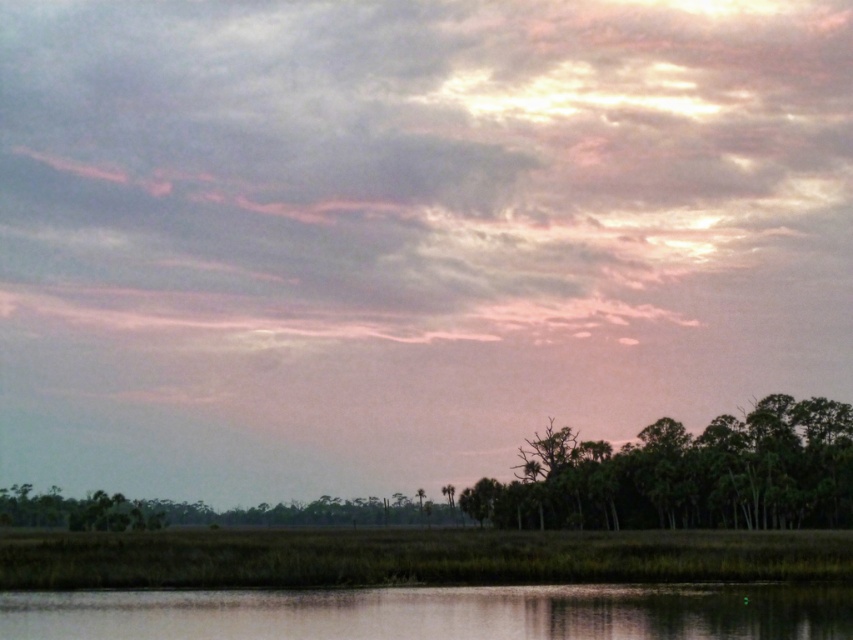
You are standing at the edge of a lake and see the smooth water at bottom and the green leafy trees at lower right. Which object takes up more space in the image?

The green leafy trees at lower right take up more space in the image than the smooth water at bottom.

You are standing in the landscape scene and want to take a photo. There are two points in the image, point 1 at coordinates point (473,602) and point 2 at coordinates point (669,440). Which point is closer to you?

Point (473,602) is closer to the camera than point (669,440).